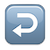
Locate an element on the screen. This screenshot has height=50, width=50. rounded corners is located at coordinates (9, 41), (40, 42), (41, 6), (7, 6).